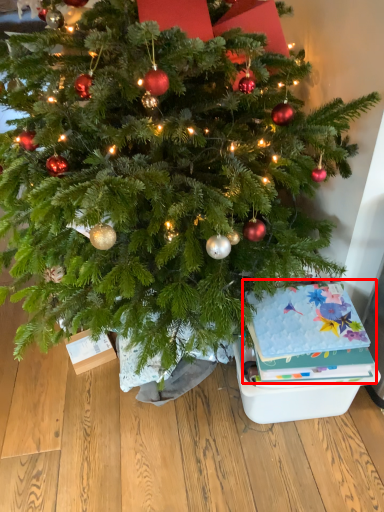
Question: Where is christmas card (annotated by the red box) located in relation to storage box in the image?

Choices:
 (A) left
 (B) right

Answer: (A)